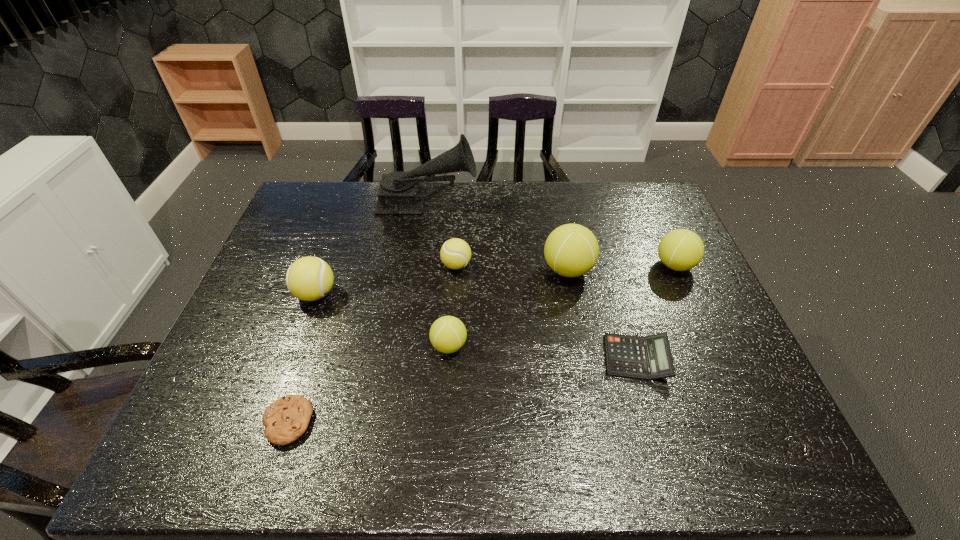
In the image, there is a desktop. Where is `vacant space at the right edge`? vacant space at the right edge is located at coordinates (640, 236).

The height and width of the screenshot is (540, 960). I want to click on vacant area at the far left corner, so click(309, 214).

The height and width of the screenshot is (540, 960). I want to click on unoccupied position between the leftmost tennis ball and the tallest tennis ball, so click(442, 282).

In order to click on vacant region between the right yellow tennis ball and the brown cookie in this screenshot , I will do `click(372, 343)`.

Where is `vacant region between the second shortest object and the brown cookie`? Image resolution: width=960 pixels, height=540 pixels. vacant region between the second shortest object and the brown cookie is located at coordinates (462, 390).

Identify the location of empty space that is in between the nearest object and the right yellow tennis ball. (x=372, y=343).

The height and width of the screenshot is (540, 960). What are the coordinates of `vacant space in between the right yellow tennis ball and the nearest object` in the screenshot? It's located at (372, 343).

Locate an element on the screen. This screenshot has width=960, height=540. free space between the farther yellow tennis ball and the shortest object is located at coordinates (372, 343).

This screenshot has height=540, width=960. Identify the location of free space between the tallest tennis ball and the tallest object. (497, 237).

Identify the location of vacant area that lies between the farthest object and the left yellow tennis ball. (372, 249).